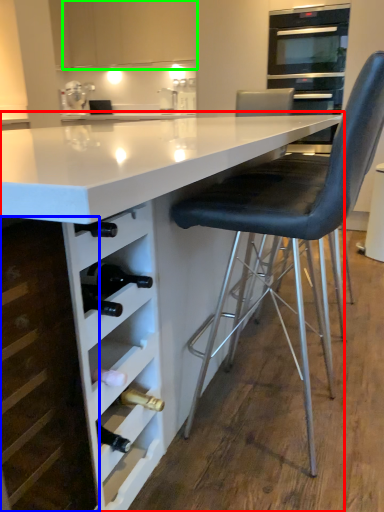
Question: Which object is positioned closest to table (highlighted by a red box)? Select from cabinetry (highlighted by a blue box) and cabinetry (highlighted by a green box).

Choices:
 (A) cabinetry
 (B) cabinetry

Answer: (A)